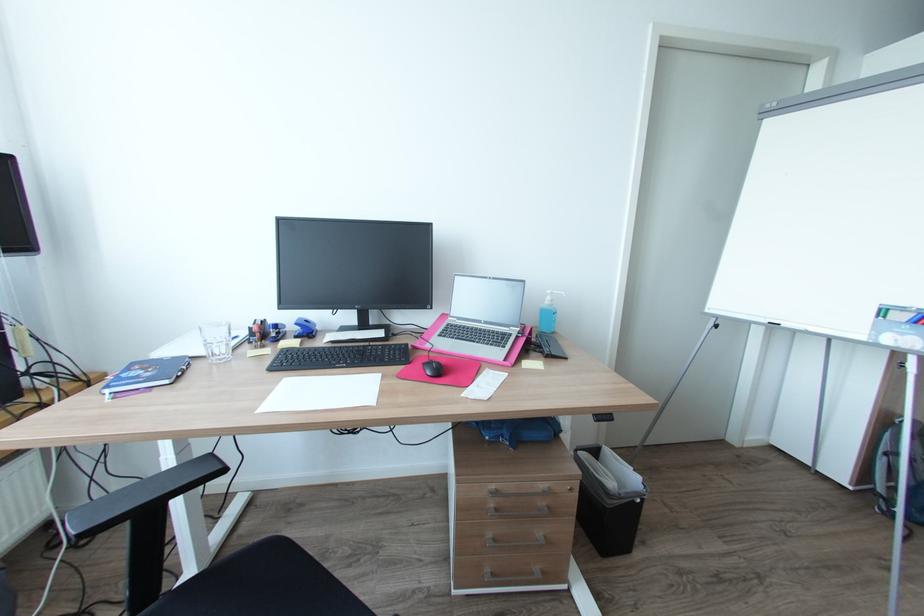
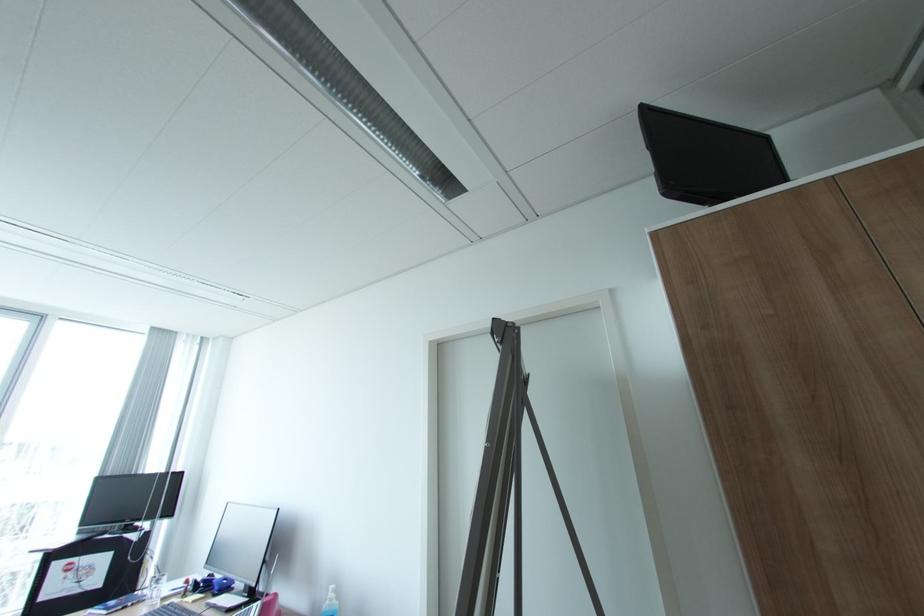
In the second image, find the point that corresponds to pixel 556 300 in the first image.

(336, 599)